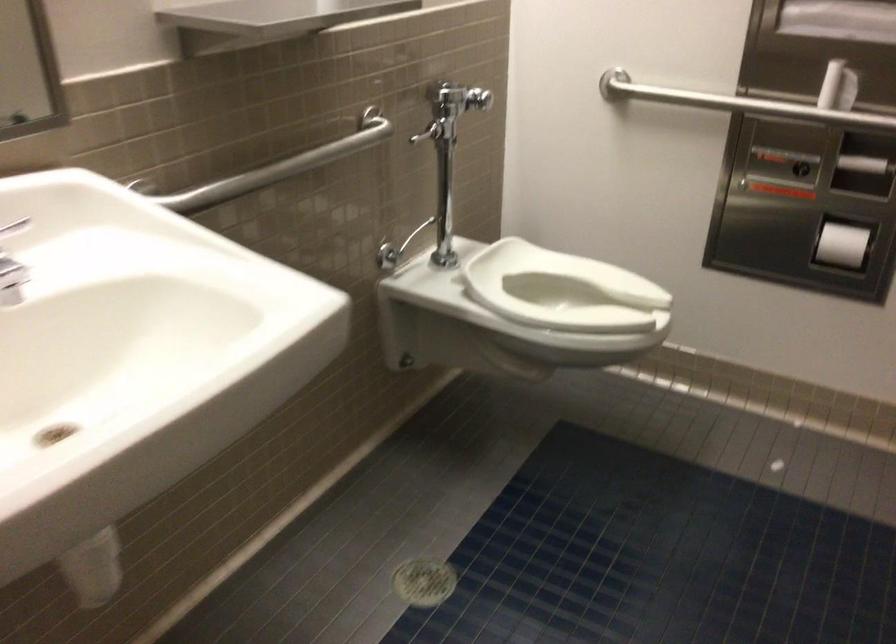
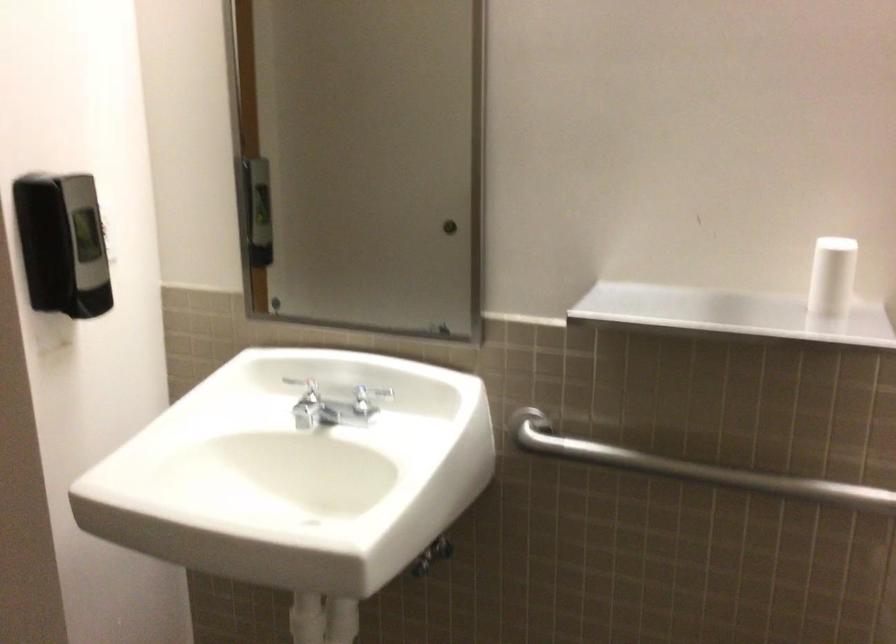
The point at (288, 169) is marked in the first image. Where is the corresponding point in the second image?

(691, 468)